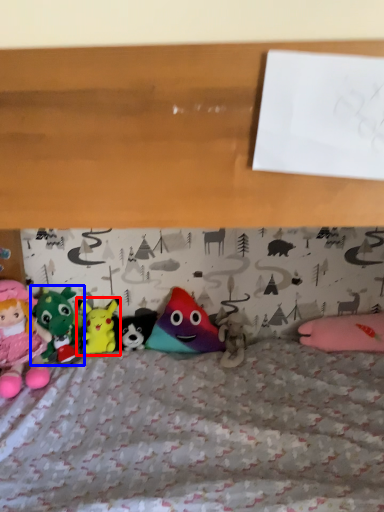
Question: Which object is closer to the camera taking this photo, toy (highlighted by a red box) or toy (highlighted by a blue box)?

Choices:
 (A) toy
 (B) toy

Answer: (B)